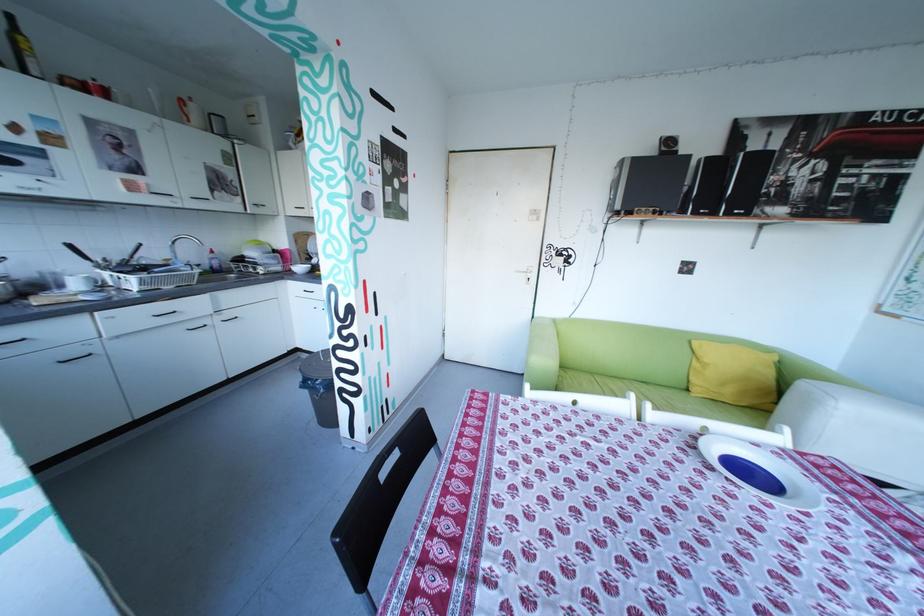
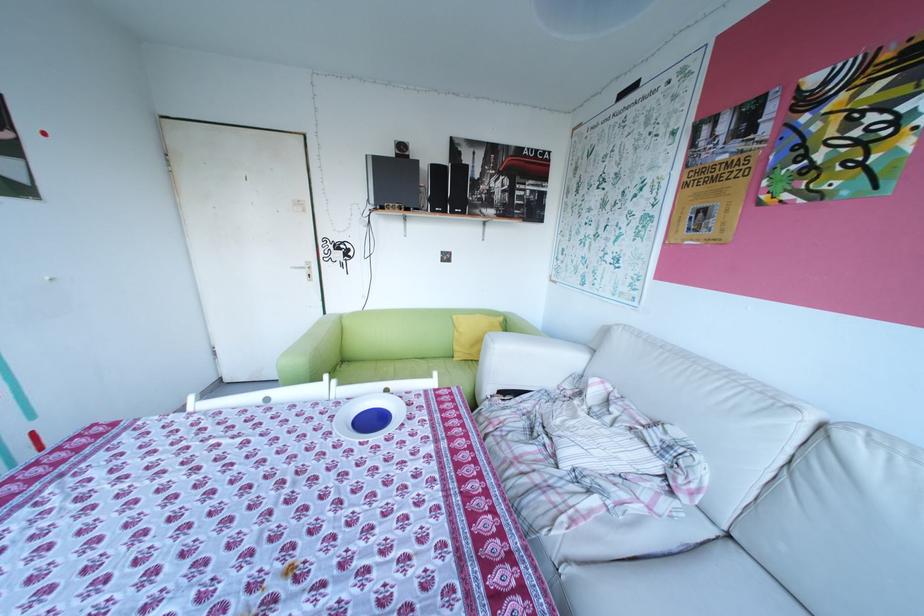
Question: How did the camera likely rotate?

Choices:
 (A) Left
 (B) Right
 (C) Up
 (D) Down

Answer: (B)